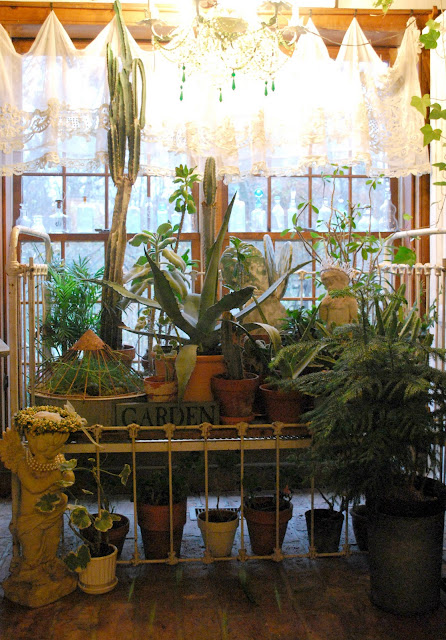
I want to click on dark gray pot, so click(x=392, y=537).